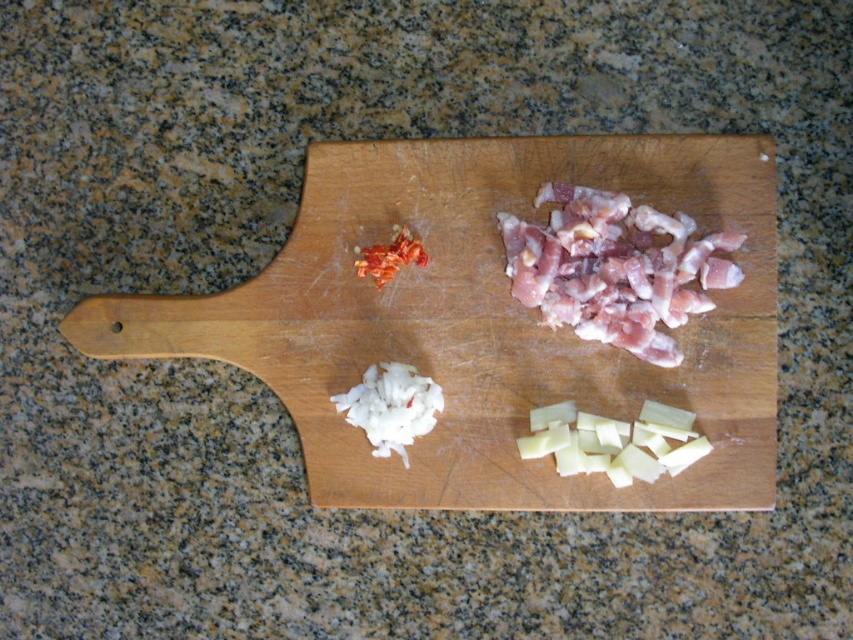
Can you confirm if pinkish raw meat at upper right is taller than white creamy cheese at bottom right?

Yes, pinkish raw meat at upper right is taller than white creamy cheese at bottom right.

Is pinkish raw meat at upper right in front of white creamy cheese at bottom right?

Yes, pinkish raw meat at upper right is closer to the viewer.

What do you see at coordinates (614, 268) in the screenshot? The image size is (853, 640). I see `pinkish raw meat at upper right` at bounding box center [614, 268].

Identify the location of pinkish raw meat at upper right. The height and width of the screenshot is (640, 853). (614, 268).

This screenshot has height=640, width=853. What do you see at coordinates (485, 321) in the screenshot?
I see `wooden cutting board at center` at bounding box center [485, 321].

Is wooden cutting board at center closer to the viewer compared to white creamy cheese at bottom right?

Yes, wooden cutting board at center is in front of white creamy cheese at bottom right.

Is point (397, 330) positioned behind point (645, 435)?

Yes.

I want to click on wooden cutting board at center, so click(485, 321).

Who is taller, wooden cutting board at center or bright red dried chili at upper center?

wooden cutting board at center

Who is more distant from viewer, (503, 273) or (366, 252)?

The point (366, 252) is behind.

The height and width of the screenshot is (640, 853). Find the location of `wooden cutting board at center`. wooden cutting board at center is located at coordinates (485, 321).